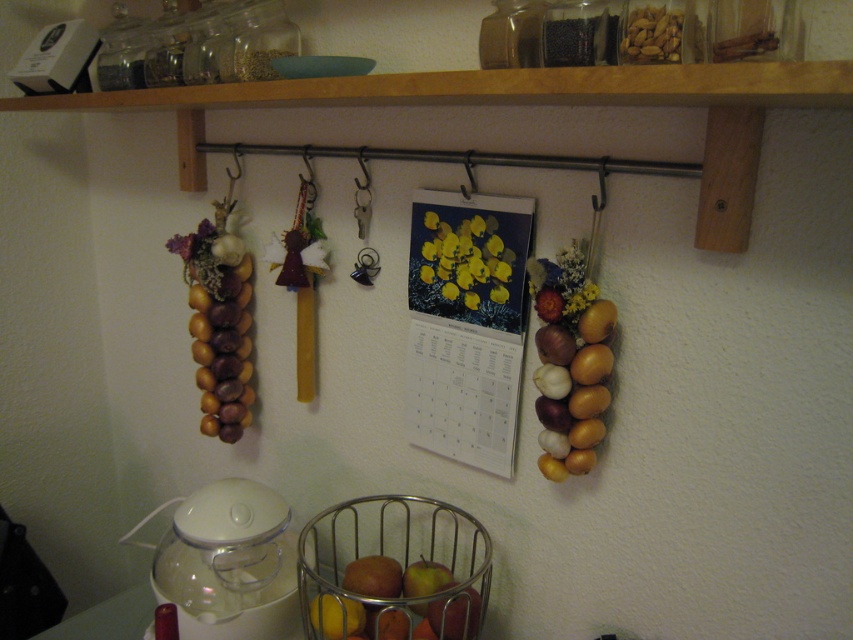
Question: Where is metallic wire basket at center located in relation to matte brown onion at right in the image?

Choices:
 (A) left
 (B) right

Answer: (A)

Question: Which point is farther to the camera?

Choices:
 (A) metallic wire basket at center
 (B) matte brown apple at center
 (C) glossy apple at center
 (D) matte brown onion at right

Answer: (C)

Question: Does glossy apple at center appear under matte brown onion at right?

Choices:
 (A) no
 (B) yes

Answer: (B)

Question: Which object appears farthest from the camera in this image?

Choices:
 (A) metallic wire basket at center
 (B) matte brown onion at right
 (C) matte brown apple at center
 (D) glossy apple at center

Answer: (D)

Question: Which of the following is the farthest from the observer?

Choices:
 (A) glossy apple at center
 (B) metallic wire basket at center
 (C) matte brown apple at center

Answer: (A)

Question: Does matte brown apple at center appear on the right side of glossy apple at center?

Choices:
 (A) no
 (B) yes

Answer: (A)